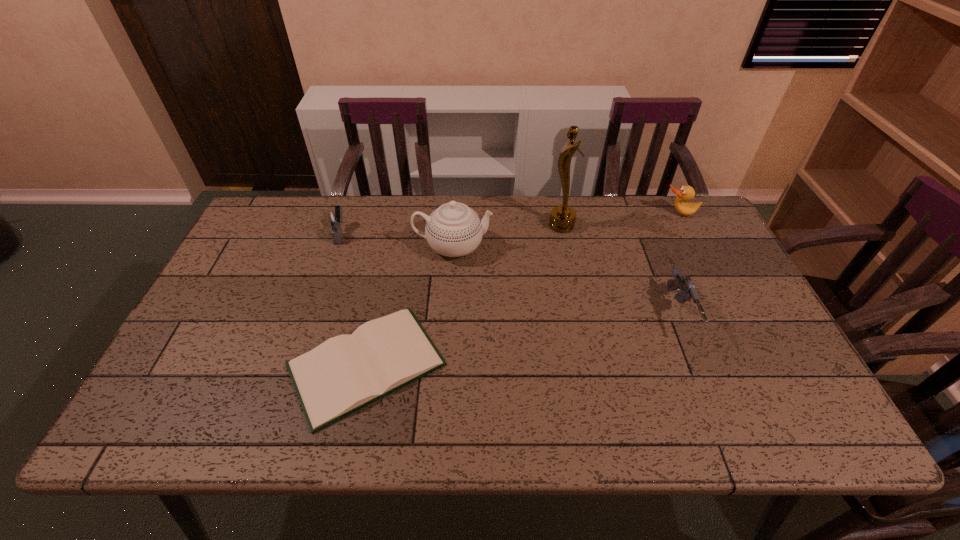
Where is `object at the right edge`? object at the right edge is located at coordinates (686, 193).

Where is `object present at the far right corner`? object present at the far right corner is located at coordinates click(686, 193).

The image size is (960, 540). In order to click on vacant space at the far edge in this screenshot , I will do `click(608, 239)`.

This screenshot has width=960, height=540. In the image, there is a desktop. Find the location of `blank space at the near edge`. blank space at the near edge is located at coordinates (420, 438).

The image size is (960, 540). I want to click on vacant space at the left edge of the desktop, so click(251, 301).

Locate an element on the screen. free space at the right edge is located at coordinates (735, 296).

In the image, there is a desktop. At what (x,y) coordinates should I click in order to perform the action: click on vacant space at the far left corner. Please return your answer as a coordinate pair (x, y). Image resolution: width=960 pixels, height=540 pixels. Looking at the image, I should click on (293, 202).

At what (x,y) coordinates should I click in order to perform the action: click on free region at the near right corner of the desktop. Please return your answer as a coordinate pair (x, y). This screenshot has height=540, width=960. Looking at the image, I should click on (813, 408).

You are a GUI agent. You are given a task and a screenshot of the screen. Output one action in this format:
    pyautogui.click(x=<x>, y=<y>)
    Task: Click on the vacant area that lies between the chinaware and the hardback book
    The image size is (960, 540).
    Given the screenshot: What is the action you would take?
    pyautogui.click(x=410, y=306)

At what (x,y) coordinates should I click in order to perform the action: click on free spot between the hardback book and the second object from right to left. Please return your answer as a coordinate pair (x, y). Looking at the image, I should click on (522, 340).